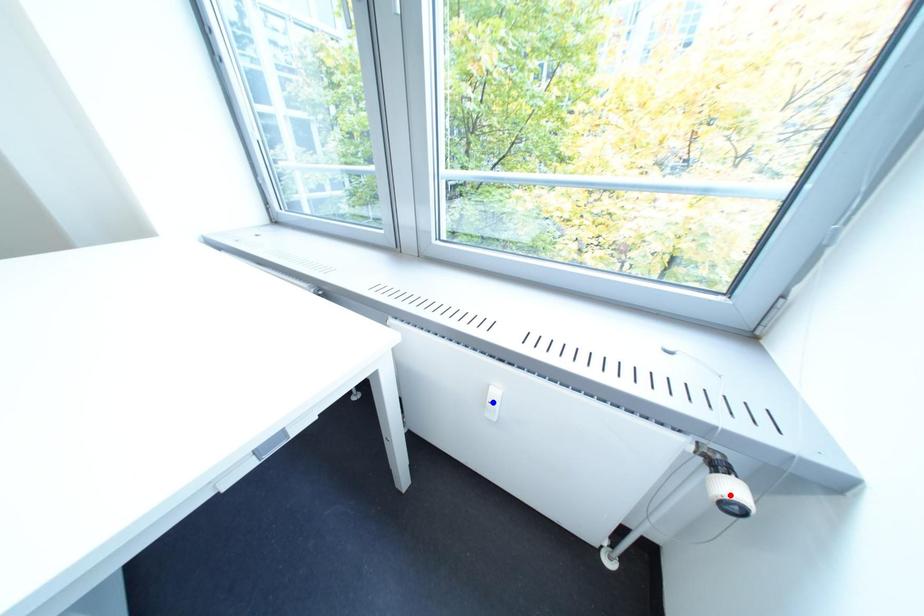
Question: Two points are marked on the image. Which point is closer to the camera?

Choices:
 (A) Blue point is closer.
 (B) Red point is closer.

Answer: (B)